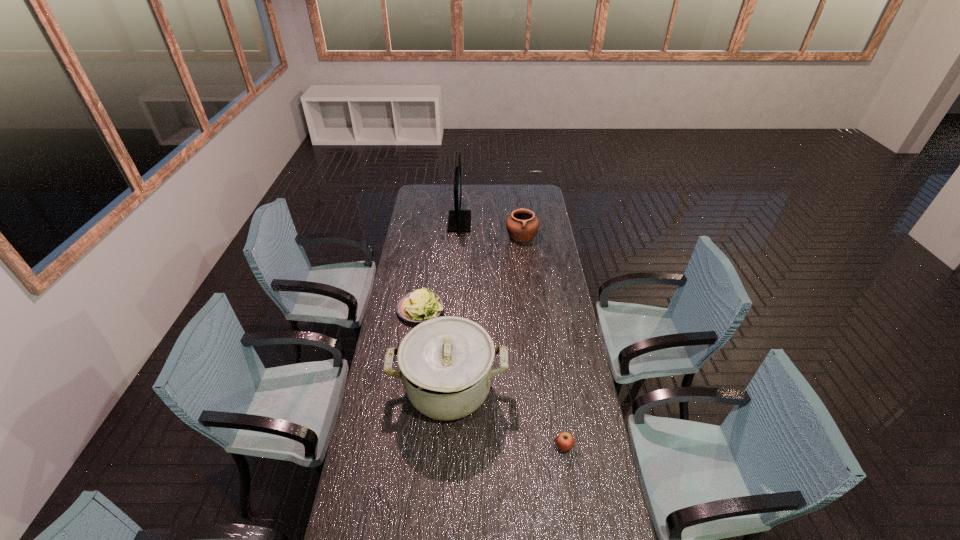
Image resolution: width=960 pixels, height=540 pixels. I want to click on vacant space in between the monitor and the third tallest object, so click(491, 228).

Identify the location of free space between the fourth farthest object and the pottery. (485, 312).

In order to click on vacant area between the lettuce and the third tallest object in this screenshot , I will do `click(471, 272)`.

Find the location of a particular element. Image resolution: width=960 pixels, height=540 pixels. free space between the tallest object and the apple is located at coordinates (512, 334).

You are a GUI agent. You are given a task and a screenshot of the screen. Output one action in this format:
    pyautogui.click(x=<x>, y=<y>)
    Task: Click on the vacant space that's between the fourth farthest object and the monitor
    This screenshot has width=960, height=540.
    Given the screenshot: What is the action you would take?
    pyautogui.click(x=454, y=305)

Where is `free space between the saucepan and the tallest object`? Image resolution: width=960 pixels, height=540 pixels. free space between the saucepan and the tallest object is located at coordinates (454, 305).

Find the location of a particular element. This screenshot has width=960, height=540. vacant point located between the third nearest object and the monitor is located at coordinates (441, 266).

Identify the location of free space between the third shortest object and the fourth farthest object. The width and height of the screenshot is (960, 540). (485, 312).

Select which object is the third closest to the third nearest object. Please provide its 2D coordinates. Your answer should be formatted as a tuple, i.e. [(x, y)], where the tuple contains the x and y coordinates of a point satisfying the conditions above.

[(522, 226)]

Where is `the third closest object to the tallest object`? the third closest object to the tallest object is located at coordinates (446, 363).